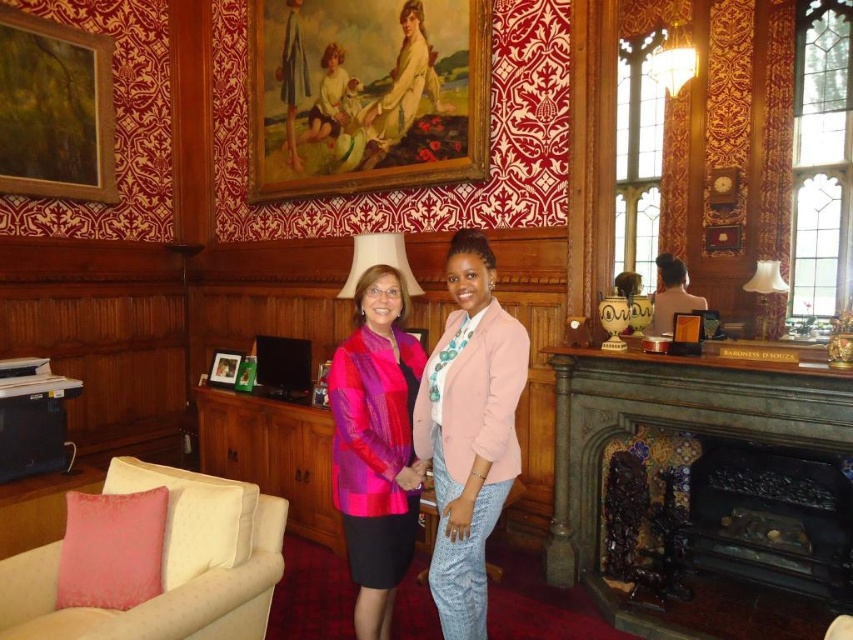
You are an interior designer who needs to hang a new picture frame exactly at the coordinates where the white fabric lampshade at upper center is located. What are the coordinates you should aim for?

You should aim for the coordinates point (x=378, y=260) where the white fabric lampshade at upper center is located.